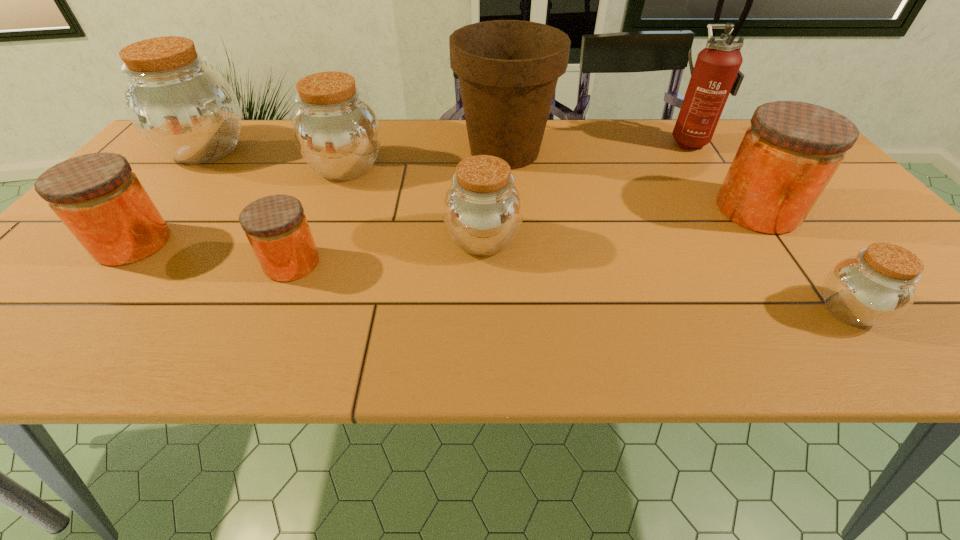
Where is `the tallest object`? This screenshot has width=960, height=540. the tallest object is located at coordinates (716, 74).

I want to click on flowerpot, so click(x=508, y=70).

Locate an element on the screen. The width and height of the screenshot is (960, 540). the biggest brown jar is located at coordinates [185, 109].

Locate an element on the screen. Image resolution: width=960 pixels, height=540 pixels. the leftmost brown jar is located at coordinates point(185,109).

Identify the location of the second brown jar from left to right. The height and width of the screenshot is (540, 960). (337, 133).

This screenshot has width=960, height=540. In order to click on the biggest orange jar in this screenshot , I will do click(x=788, y=155).

This screenshot has width=960, height=540. What are the coordinates of `the second smallest orange jar` in the screenshot? It's located at (100, 200).

This screenshot has height=540, width=960. I want to click on the third jar from right to left, so click(x=483, y=210).

Locate an element on the screen. the third farthest brown jar is located at coordinates (483, 210).

Identify the location of the second orange jar from left to right. (276, 226).